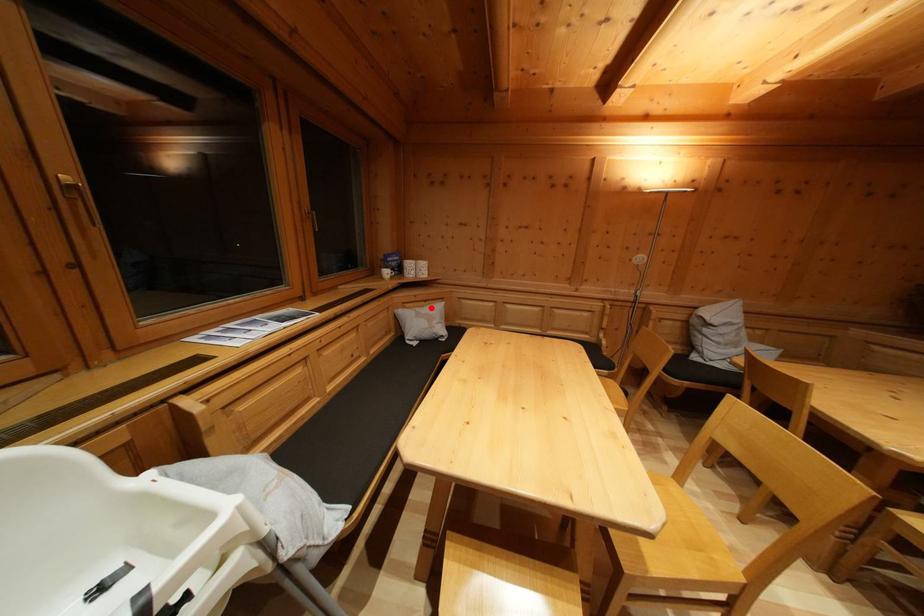
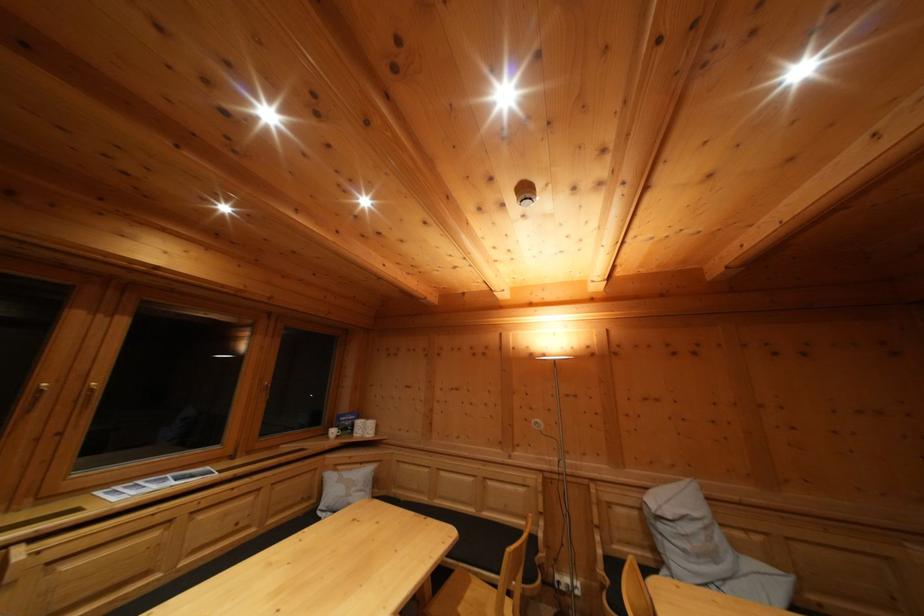
Question: I am providing you with two images of the same scene from different viewpoints. A red point is shown in image1. For the corresponding object point in image2, is it positioned nearer or farther from the camera?

Choices:
 (A) Nearer
 (B) Farther

Answer: (B)